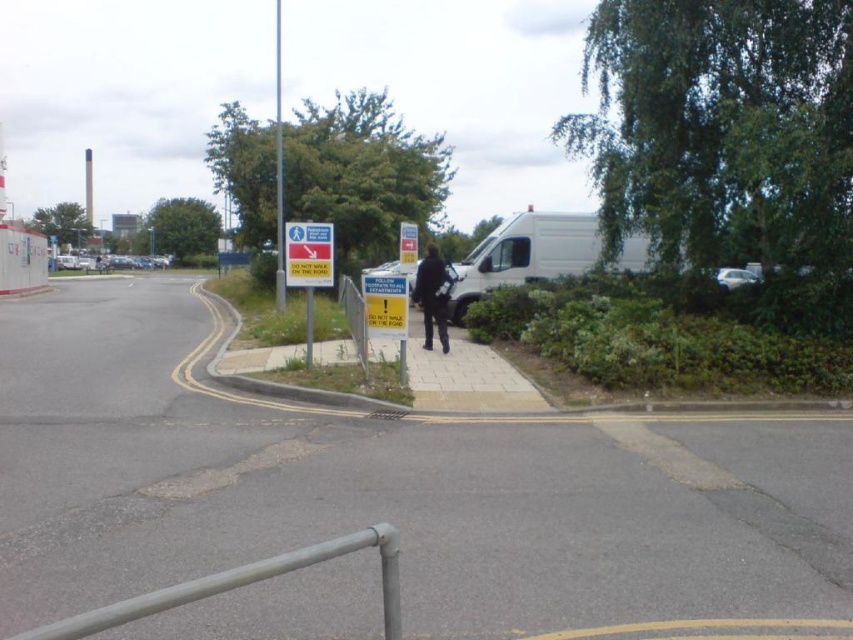
Who is taller, white plastic sign at center or dark blue jacket at center?

Standing taller between the two is dark blue jacket at center.

Is point (292, 282) less distant than point (431, 340)?

Yes, point (292, 282) is closer to viewer.

Find the location of a particular element. This screenshot has height=640, width=853. white plastic sign at center is located at coordinates (308, 253).

The height and width of the screenshot is (640, 853). Find the location of `white plastic sign at center`. white plastic sign at center is located at coordinates (308, 253).

Can you confirm if dark blue jacket at center is smaller than metallic silver car at right?

Yes.

Does dark blue jacket at center appear on the right side of metallic silver car at right?

Incorrect, dark blue jacket at center is not on the right side of metallic silver car at right.

The width and height of the screenshot is (853, 640). What do you see at coordinates (432, 296) in the screenshot?
I see `dark blue jacket at center` at bounding box center [432, 296].

At what (x,y) coordinates should I click in order to perform the action: click on dark blue jacket at center. Please return your answer as a coordinate pair (x, y). The height and width of the screenshot is (640, 853). Looking at the image, I should click on (432, 296).

Can you confirm if white plastic sign at center is shorter than metallic silver car at right?

Incorrect, white plastic sign at center's height does not fall short of metallic silver car at right's.

Identify the location of white plastic sign at center. This screenshot has height=640, width=853. (308, 253).